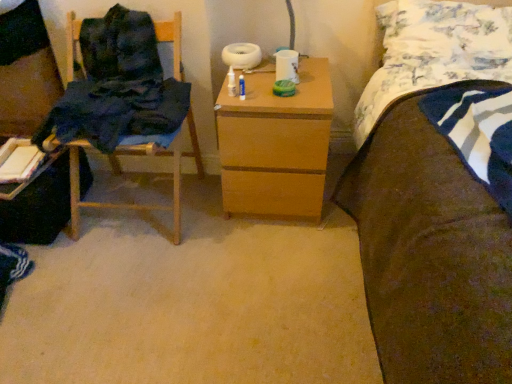
Image resolution: width=512 pixels, height=384 pixels. Identify the location of free point below wooden chair at left (from a real-world perspective). [x=145, y=217].